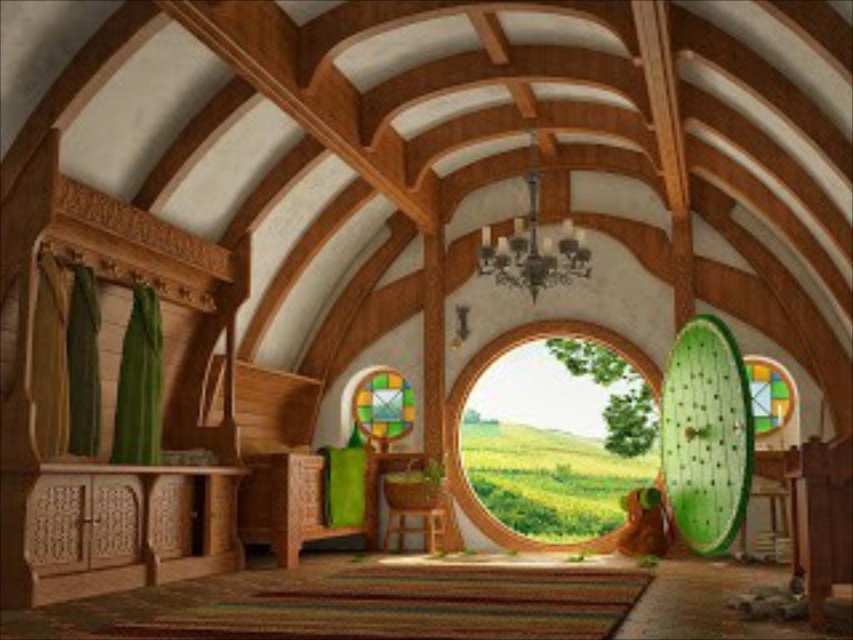
Question: From the image, what is the correct spatial relationship of wooden circle at center in relation to wooden chair at center?

Choices:
 (A) below
 (B) above

Answer: (B)

Question: Can you confirm if wooden circle at center is positioned above metallic chandelier at center?

Choices:
 (A) no
 (B) yes

Answer: (A)

Question: Which of the following is the farthest from the observer?

Choices:
 (A) (451, 476)
 (B) (492, 276)
 (C) (780, 371)

Answer: (B)

Question: Which object is farther from the camera taking this photo?

Choices:
 (A) metallic chandelier at center
 (B) wooden chair at center
 (C) stained glass window at center

Answer: (C)

Question: Which object is the closest to the wooden circle at center?

Choices:
 (A) metallic chandelier at center
 (B) stained glass window at center
 (C) wooden chair at center

Answer: (C)

Question: Does wooden circle at center have a larger size compared to wooden chair at center?

Choices:
 (A) no
 (B) yes

Answer: (B)